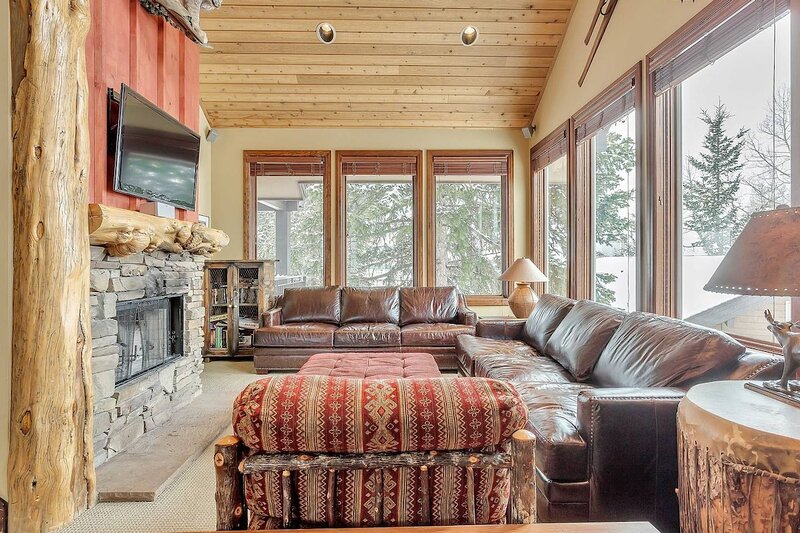
Image resolution: width=800 pixels, height=533 pixels. In order to click on couch in this screenshot , I will do `click(566, 373)`.